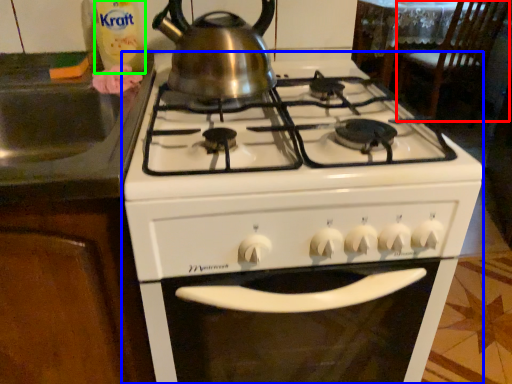
Question: Considering the real-world distances, which object is closest to chair (highlighted by a red box)? gas stove (highlighted by a blue box) or bottle (highlighted by a green box).

Choices:
 (A) gas stove
 (B) bottle

Answer: (A)